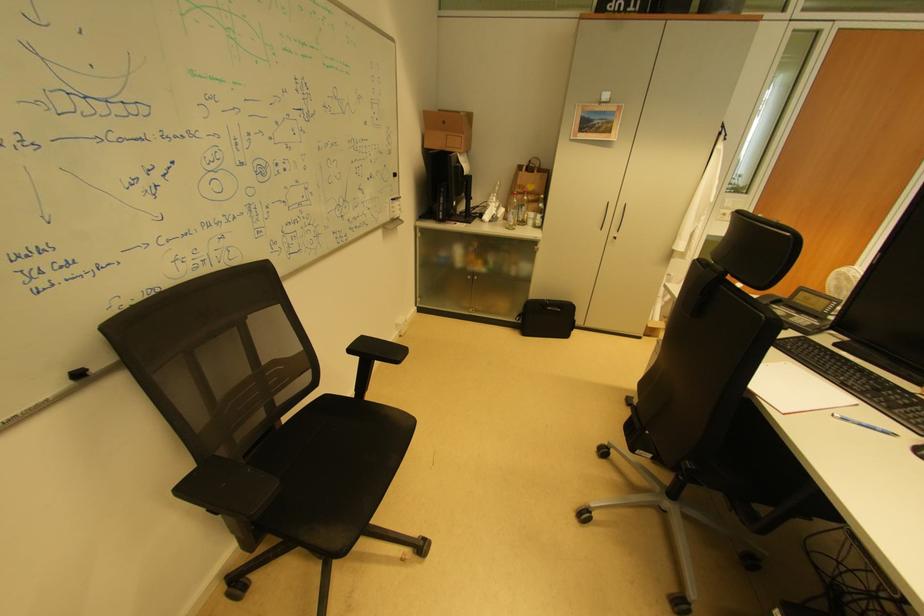
The height and width of the screenshot is (616, 924). What do you see at coordinates (334, 456) in the screenshot?
I see `a black chair sitting surface` at bounding box center [334, 456].